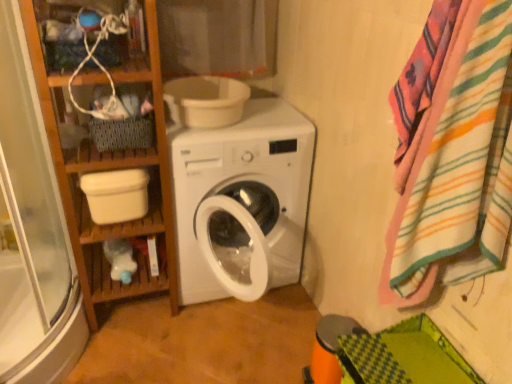
Find the location of a particular element. This screenshot has width=512, height=384. vacant space to the right of white plastic bowl at upper center, which appears as the second toilet bowl when ordered from the bottom is located at coordinates (279, 119).